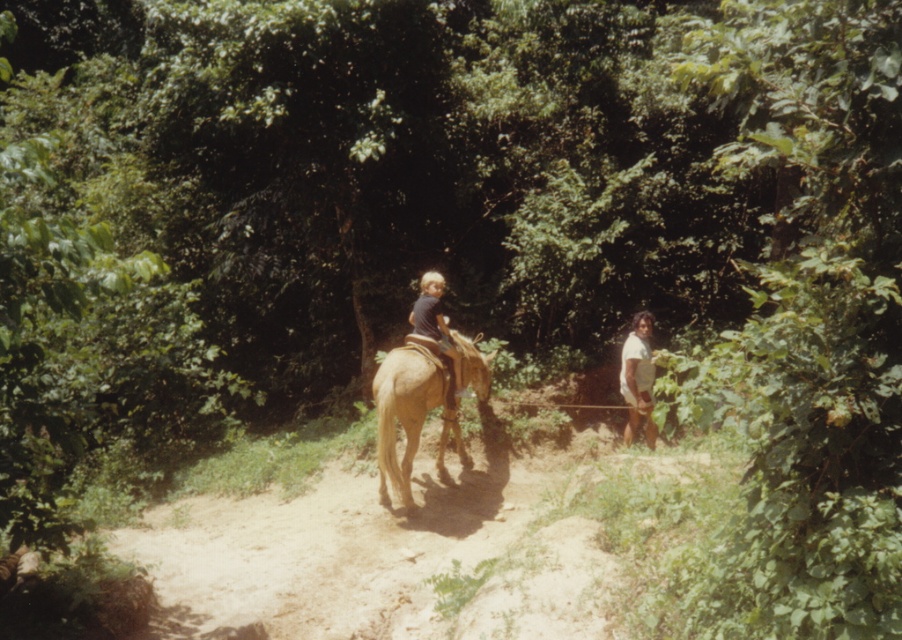
Is point (628, 349) positioned after point (413, 301)?

That is False.

Who is more forward, (646, 321) or (444, 323)?

Point (444, 323)

Locate an element on the screen. Image resolution: width=902 pixels, height=640 pixels. white matte shirt at right is located at coordinates (638, 378).

Locate an element on the screen. Image resolution: width=902 pixels, height=640 pixels. light brown smooth horse at center is located at coordinates (403, 412).

Who is positioned more to the left, light brown smooth horse at center or white matte shirt at right?

light brown smooth horse at center

Locate an element on the screen. The height and width of the screenshot is (640, 902). light brown smooth horse at center is located at coordinates (403, 412).

Is light brown smooth horse at center shorter than light brown horse at center?

No.

Measure the distance between point (x=420, y=371) and camera.

The distance of point (x=420, y=371) from camera is 9.08 meters.

Does point (410, 426) lie in front of point (431, 305)?

Yes, it is in front of point (431, 305).

What are the coordinates of `light brown smooth horse at center` in the screenshot? It's located at (403, 412).